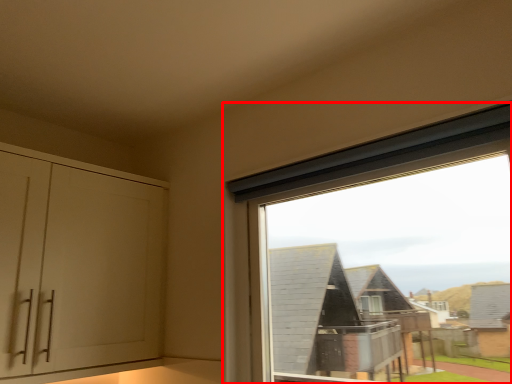
Question: From the image's perspective, where is window (annotated by the red box) located in relation to cabinetry in the image?

Choices:
 (A) below
 (B) above

Answer: (B)